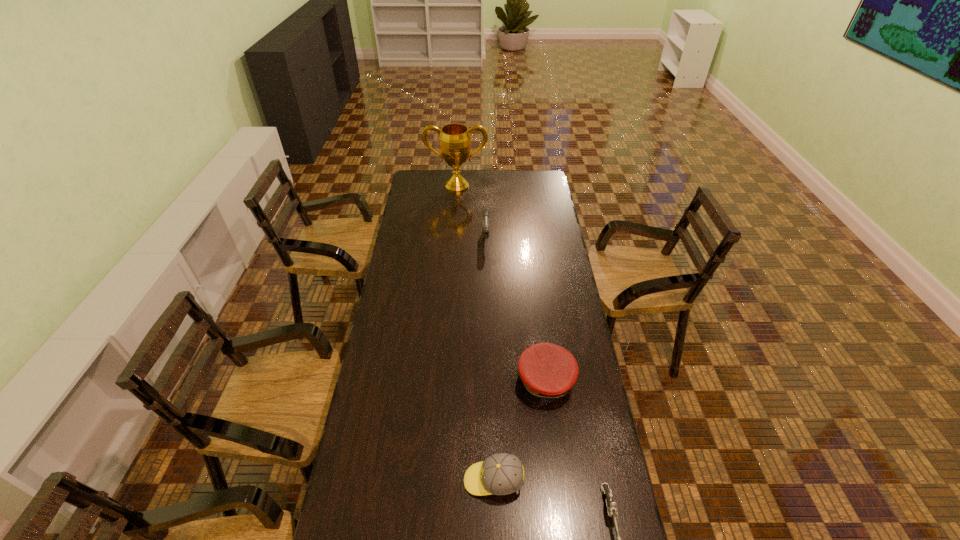
You are a GUI agent. You are given a task and a screenshot of the screen. Output one action in this format:
    pyautogui.click(x=<x>, y=<y>)
    Task: Click on the vacant region between the award and the baseball cap
    This screenshot has width=960, height=540.
    Given the screenshot: What is the action you would take?
    pyautogui.click(x=475, y=333)

What are the coordinates of `vacant area that lies between the baseball cap and the tallest object` in the screenshot? It's located at (475, 333).

Image resolution: width=960 pixels, height=540 pixels. I want to click on vacant space in between the fourth shortest object and the tallest object, so click(471, 212).

Where is `vacant space that is in between the tallest object and the third farthest object`? vacant space that is in between the tallest object and the third farthest object is located at coordinates (501, 284).

Locate an element on the screen. unoccupied area between the fourth shortest object and the cap is located at coordinates (516, 309).

Where is `empty space between the award and the baseball cap`? This screenshot has width=960, height=540. empty space between the award and the baseball cap is located at coordinates (475, 333).

Locate an element on the screen. The height and width of the screenshot is (540, 960). free space that is in between the taller gun and the baseball cap is located at coordinates (490, 359).

You are a GUI agent. You are given a task and a screenshot of the screen. Output one action in this format:
    pyautogui.click(x=<x>, y=<y>)
    Task: Click on the free spot between the award and the fourth nearest object
    The height and width of the screenshot is (540, 960).
    Given the screenshot: What is the action you would take?
    pyautogui.click(x=471, y=212)

You are a GUI agent. You are given a task and a screenshot of the screen. Output one action in this format:
    pyautogui.click(x=<x>, y=<y>)
    Task: Click on the vacant point located between the taller gun and the third nearest object
    This screenshot has height=540, width=960.
    Given the screenshot: What is the action you would take?
    pyautogui.click(x=516, y=309)

Choose which object is the nearest neighbor to the baseball cap. Please provide its 2D coordinates. Your answer should be formatted as a tuple, i.e. [(x, y)], where the tuple contains the x and y coordinates of a point satisfying the conditions above.

[(547, 371)]